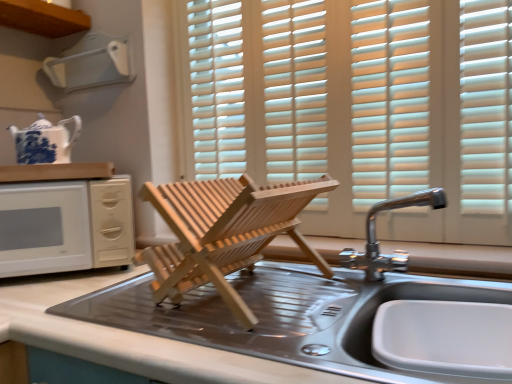
Question: Relative to white plastic vent at upper left, is chrome metallic faucet at upper right in front or behind?

Choices:
 (A) front
 (B) behind

Answer: (A)

Question: Would you say chrome metallic faucet at upper right is to the left or to the right of white plastic vent at upper left in the picture?

Choices:
 (A) right
 (B) left

Answer: (A)

Question: Estimate the real-world distances between objects in this image. Which object is farther from the chrome metallic faucet at upper right?

Choices:
 (A) metallic stainless steel sink at center, which is the first countertop in right-to-left order
 (B) blue and white porcelain teapot at upper left
 (C) white matte microwave at left
 (D) metallic stainless steel sink at center
 (E) white wood blinds at center

Answer: (B)

Question: Estimate the real-world distances between objects in this image. Which object is closer to the white plastic vent at upper left?

Choices:
 (A) white wood blinds at center
 (B) white wood countertop at upper left, the first countertop viewed from the top
 (C) blue and white porcelain teapot at upper left
 (D) metallic stainless steel sink at center
 (E) white matte microwave at left

Answer: (C)